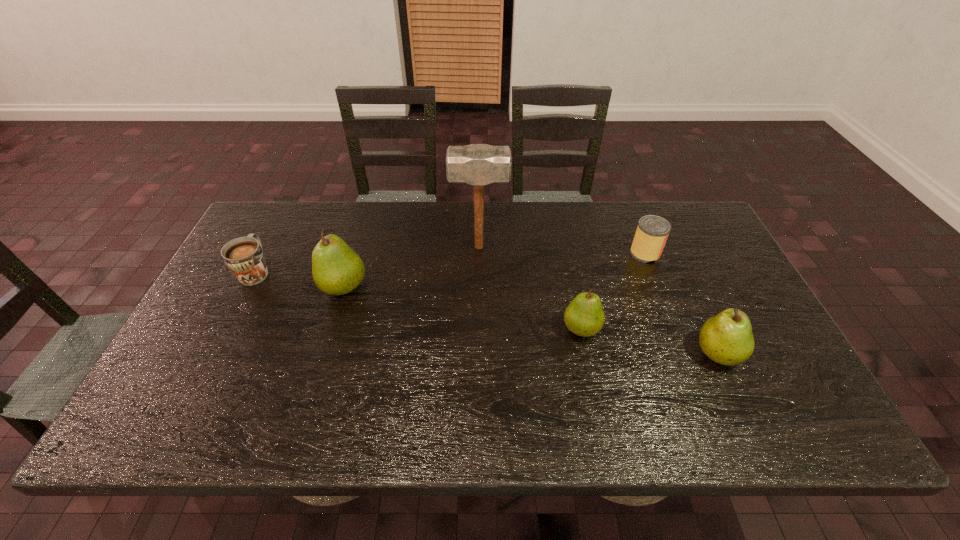
The height and width of the screenshot is (540, 960). I want to click on the leftmost pear, so click(x=337, y=269).

I want to click on the second object from left to right, so click(337, 269).

I want to click on the third object from right to left, so (x=584, y=316).

This screenshot has height=540, width=960. Find the location of `the second pear from left to right`. the second pear from left to right is located at coordinates (584, 316).

Where is `the rightmost pear`? the rightmost pear is located at coordinates (727, 339).

The height and width of the screenshot is (540, 960). What are the coordinates of `the second shortest pear` in the screenshot? It's located at (727, 339).

Image resolution: width=960 pixels, height=540 pixels. I want to click on mallet, so tap(477, 164).

Where is `the tallest object`? The image size is (960, 540). the tallest object is located at coordinates (477, 164).

Where is `the leftmost object`? the leftmost object is located at coordinates (244, 256).

This screenshot has height=540, width=960. In order to click on can in this screenshot , I will do `click(652, 232)`.